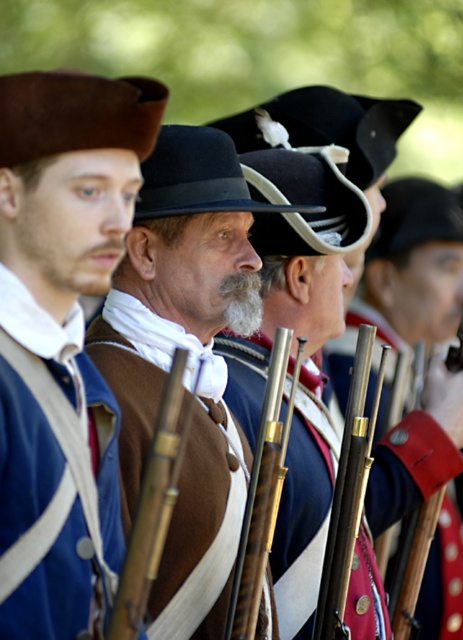
Does brown suede hat at center have a lesser width compared to wooden smooth rifle at center?

In fact, brown suede hat at center might be wider than wooden smooth rifle at center.

Between brown suede hat at center and wooden smooth rifle at center, which one appears on the left side from the viewer's perspective?

brown suede hat at center is more to the left.

Where is `brown suede hat at center`? brown suede hat at center is located at coordinates (181, 324).

From the picture: Who is positioned more to the right, shiny gold rifle at center or wooden smooth rifle at center?

shiny gold rifle at center

Can you confirm if shiny gold rifle at center is positioned to the right of wooden smooth rifle at center?

Correct, you'll find shiny gold rifle at center to the right of wooden smooth rifle at center.

Image resolution: width=463 pixels, height=640 pixels. Describe the element at coordinates (407, 275) in the screenshot. I see `shiny gold rifle at center` at that location.

Find the location of a particular element. shiny gold rifle at center is located at coordinates (407, 275).

Who is more distant from viewer, (x=133, y=400) or (x=313, y=625)?

The point (x=313, y=625) is more distant.

Which is behind, point (144, 292) or point (364, 352)?

The point (144, 292) is behind.

Where is `brown suede hat at center`? The width and height of the screenshot is (463, 640). brown suede hat at center is located at coordinates (181, 324).